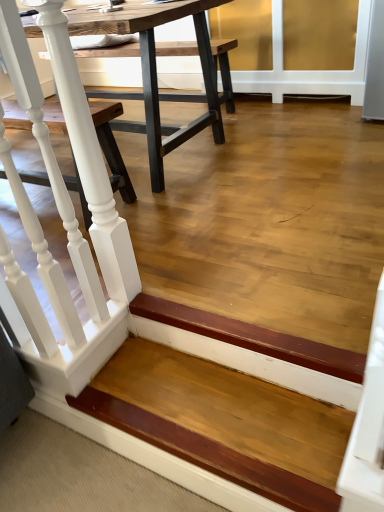
Question: Is white painted wood railing at left at the left side of wooden step at lower left?

Choices:
 (A) no
 (B) yes

Answer: (B)

Question: Is white painted wood railing at left oriented away from wooden step at lower left?

Choices:
 (A) no
 (B) yes

Answer: (A)

Question: Can you confirm if white painted wood railing at left is wider than wooden step at lower left?

Choices:
 (A) no
 (B) yes

Answer: (A)

Question: Considering the relative sizes of white painted wood railing at left and wooden step at lower left in the image provided, is white painted wood railing at left taller than wooden step at lower left?

Choices:
 (A) no
 (B) yes

Answer: (B)

Question: Is white painted wood railing at left smaller than wooden step at lower left?

Choices:
 (A) yes
 (B) no

Answer: (B)

Question: Would you say white painted wood railing at left is outside wooden step at lower left?

Choices:
 (A) no
 (B) yes

Answer: (B)

Question: Considering the relative sizes of wooden table at center and white painted wood railing at left in the image provided, is wooden table at center smaller than white painted wood railing at left?

Choices:
 (A) no
 (B) yes

Answer: (A)

Question: From the image's perspective, is wooden table at center below white painted wood railing at left?

Choices:
 (A) no
 (B) yes

Answer: (A)

Question: From a real-world perspective, is wooden table at center positioned over white painted wood railing at left based on gravity?

Choices:
 (A) no
 (B) yes

Answer: (A)

Question: Is wooden table at center not near white painted wood railing at left?

Choices:
 (A) yes
 (B) no

Answer: (A)

Question: Is wooden table at center at the left side of white painted wood railing at left?

Choices:
 (A) no
 (B) yes

Answer: (B)

Question: Would you say wooden table at center contains white painted wood railing at left?

Choices:
 (A) yes
 (B) no

Answer: (B)

Question: Can you confirm if wooden step at lower left is bigger than wooden table at center?

Choices:
 (A) no
 (B) yes

Answer: (A)